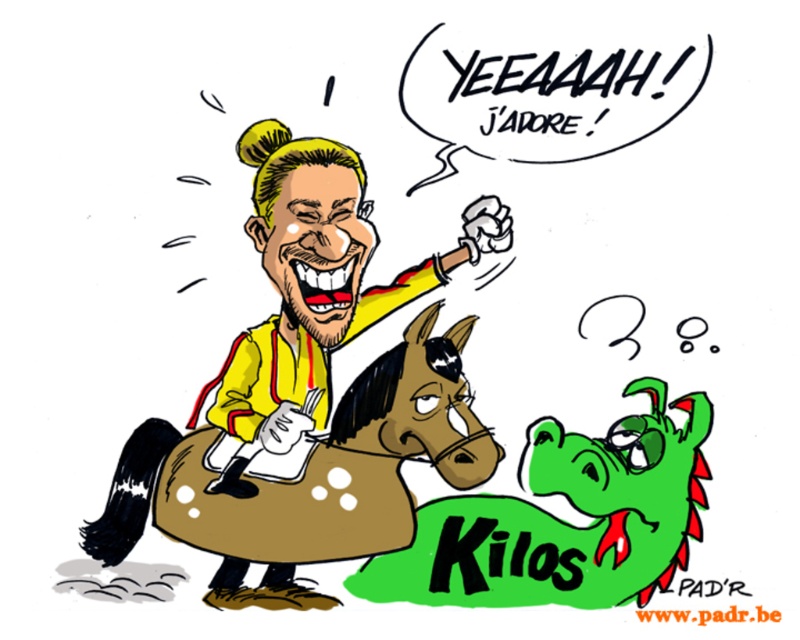
You are a cartoon character trying to reach the top of the yellow matte jacket at center while standing on the brown leather horse at center. Can you reach it without jumping?

The brown leather horse at center is shorter than the yellow matte jacket at center, so you can reach the top of the yellow matte jacket at center without jumping while standing on the brown leather horse at center.

You are standing at the camera position and want to take a photo of the brown leather horse at center. If your camera has a maximum focus range of 9 feet, will you be able to capture the horse clearly?

The brown leather horse at center and camera are 9.39 feet apart from each other. Since the maximum focus range is 9 feet, the distance is slightly beyond the camera can focus, so the horse will not be captured clearly.

You are an artist trying to draw the horse in the image. You want to make sure the perspective looks correct. Which of the two points, point (176, 465) or point (312, 225), should be placed closer to the viewer in your drawing?

Point (176, 465) should be placed closer to the viewer because it is closer to the camera than point (312, 225) according to the description.